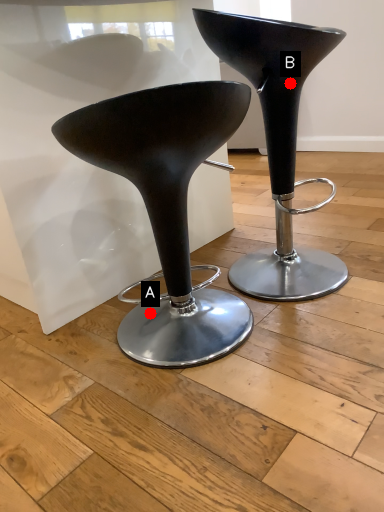
Question: Two points are circled on the image, labeled by A and B beside each circle. Which point is closer to the camera taking this photo?

Choices:
 (A) A is closer
 (B) B is closer

Answer: (B)